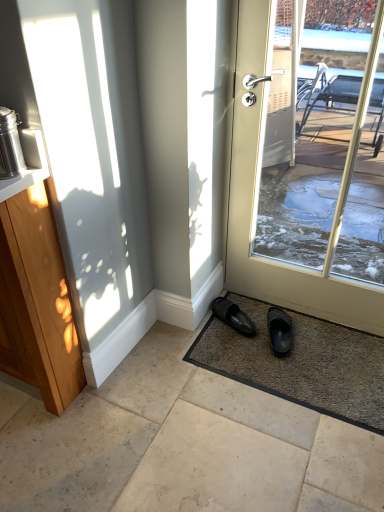
At what (x,y) coordinates should I click in order to perform the action: click on blank space above brown textured mat at lower center (from a real-world perspective). Please return your answer as a coordinate pair (x, y). Looking at the image, I should click on point(290,350).